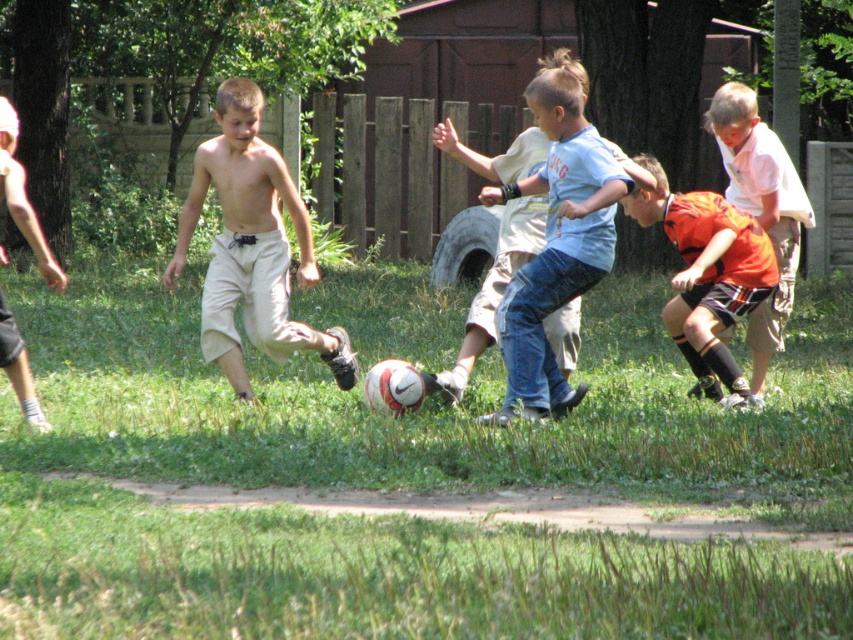
Who is positioned more to the right, blue denim jeans at center or orange jersey shorts at lower right?

orange jersey shorts at lower right

Which of these two, blue denim jeans at center or orange jersey shorts at lower right, stands taller?

blue denim jeans at center

Does point (532, 328) come in front of point (676, 220)?

Yes, point (532, 328) is closer to viewer.

This screenshot has height=640, width=853. I want to click on blue denim jeans at center, so click(555, 244).

Which is above, beige cotton shorts at center or tan cotton shorts at left?

beige cotton shorts at center

Does point (280, 310) come behind point (0, 124)?

Yes, it is.

The image size is (853, 640). Find the location of `beige cotton shorts at center`. beige cotton shorts at center is located at coordinates (251, 246).

Between beige cotton shorts at center and orange striped shorts at center, which one is positioned higher?

orange striped shorts at center

Is point (219, 344) behind point (782, 253)?

That is False.

Does point (239, 225) come closer to viewer compared to point (752, 346)?

That is True.

Find the location of a particular element. beige cotton shorts at center is located at coordinates (251, 246).